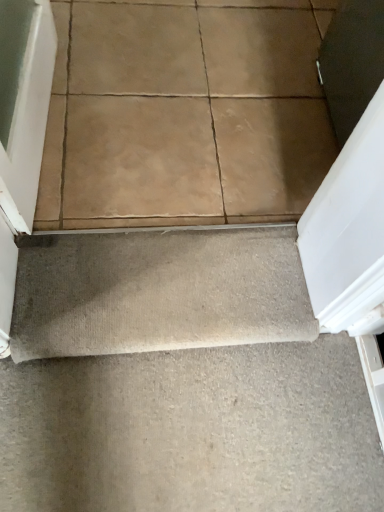
Find the location of `brown matte tile at center`. brown matte tile at center is located at coordinates [x=184, y=115].

The height and width of the screenshot is (512, 384). Describe the element at coordinates (184, 115) in the screenshot. I see `brown matte tile at center` at that location.

Measure the distance between brown matte tile at center and camera.

They are 3.68 feet apart.

Measure the distance between point (x=86, y=82) and camera.

The depth of point (x=86, y=82) is 1.36 meters.

The height and width of the screenshot is (512, 384). In order to click on brown matte tile at center in this screenshot , I will do `click(184, 115)`.